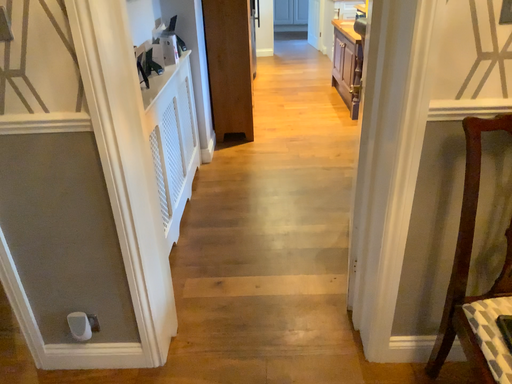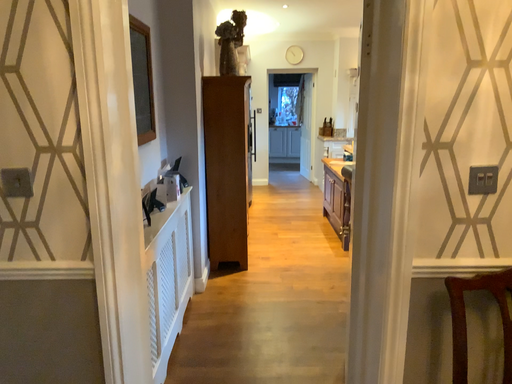
Question: Which way did the camera rotate in the video?

Choices:
 (A) rotated downward
 (B) rotated upward

Answer: (B)